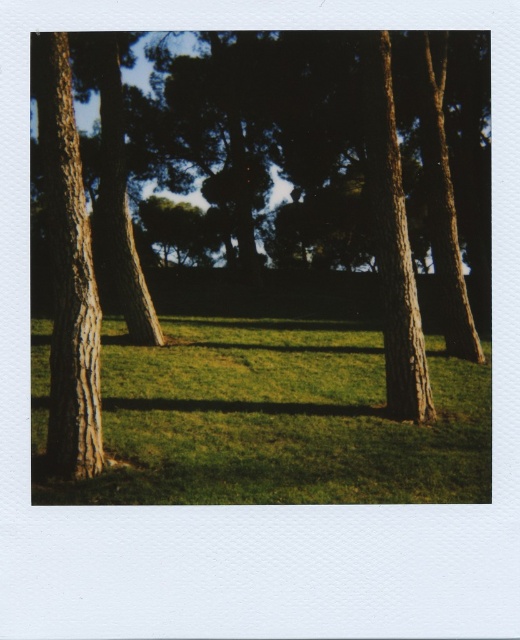
Who is shorter, smooth brown tree trunk at left or smooth brown tree trunk at right?

smooth brown tree trunk at left

Between smooth brown tree trunk at left and smooth brown tree trunk at right, which one appears on the right side from the viewer's perspective?

Positioned to the right is smooth brown tree trunk at right.

Does point (43, 35) come closer to viewer compared to point (393, 349)?

That is True.

Find the location of a particular element. Image resolution: width=520 pixels, height=640 pixels. smooth brown tree trunk at left is located at coordinates (68, 269).

Is point (396, 356) closer to camera compared to point (434, 257)?

Yes, it is in front of point (434, 257).

At what (x,y) coordinates should I click in order to perform the action: click on smooth brown tree trunk at right. Please return your answer as a coordinate pair (x, y). The height and width of the screenshot is (640, 520). Looking at the image, I should click on (393, 241).

Is brown rough bark tree at center taller than smooth brown tree trunk at right?

Correct, brown rough bark tree at center is much taller as smooth brown tree trunk at right.

Is brown rough bark tree at center further to the viewer compared to smooth brown tree trunk at right?

No.

Does point (292, 312) come closer to viewer compared to point (394, 392)?

No, (292, 312) is further to viewer.

Locate an element on the screen. The width and height of the screenshot is (520, 640). brown rough bark tree at center is located at coordinates (267, 292).